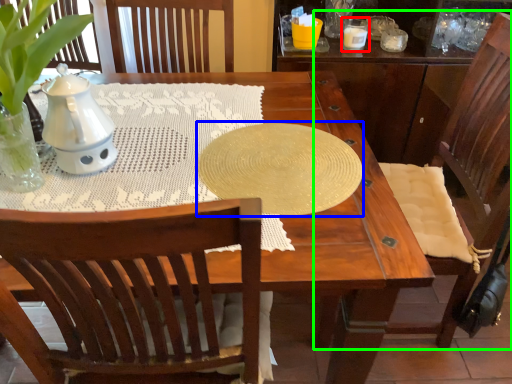
Question: Which object is the closest to the candle holder (highlighted by a red box)? Choose among these: oval (highlighted by a blue box) or chair (highlighted by a green box).

Choices:
 (A) oval
 (B) chair

Answer: (B)